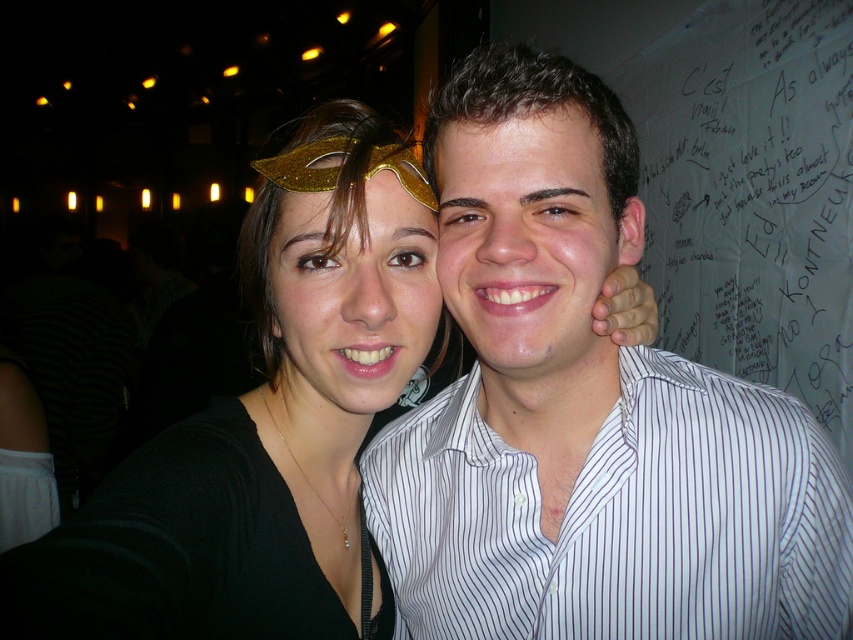
Question: Which point is farther to the camera?

Choices:
 (A) smooth white shirt at center
 (B) white striped shirt at upper right

Answer: (A)

Question: Is matte black mask at upper left behind white paper at upper right?

Choices:
 (A) yes
 (B) no

Answer: (B)

Question: Which object appears closest to the camera in this image?

Choices:
 (A) matte gold mask at center
 (B) white striped shirt at right

Answer: (A)

Question: Among these objects, which one is farthest from the camera?

Choices:
 (A) white striped shirt at right
 (B) white paper at upper right
 (C) smooth white shirt at center
 (D) matte gold mask at center

Answer: (B)

Question: Is matte black mask at upper left thinner than matte gold mask at center?

Choices:
 (A) no
 (B) yes

Answer: (A)

Question: Is white striped shirt at right further to the viewer compared to smooth white shirt at center?

Choices:
 (A) yes
 (B) no

Answer: (A)